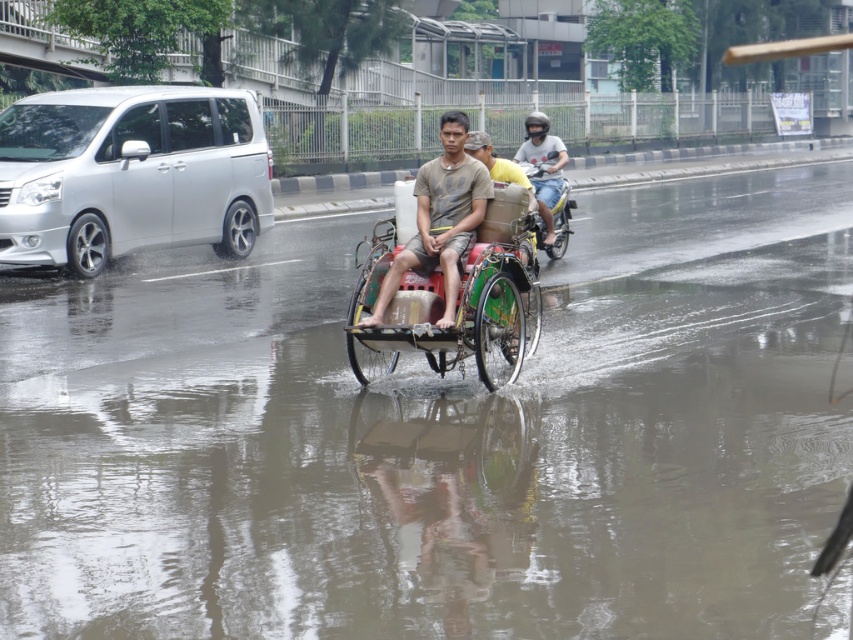
You are a delivery driver who needs to park your vehicle near the silver metallic van at left without blocking the rickshaw. Based on the coordinates provided in the scene description, where should you position your vehicle?

The silver metallic van at left is located at point (131, 173). To park near it without blocking the rickshaw, position your vehicle close to those coordinates but ensure it doesn not obstruct the rickshaw.

You are a pedestrian trying to cross the street and see the brown fabric tricycle at center and the matte black helmet at upper center. Which object is nearer to you?

The brown fabric tricycle at center is closer to the viewer than the matte black helmet at upper center, so the tricycle is nearer.

In the scene shown: You are a delivery person who needs to park your vehicle next to the silver metallic van at left and the brown fabric tricycle at center. Since the parking space is narrow, which vehicle should you park closer to the curb to avoid blocking the road?

The silver metallic van at left is wider than the brown fabric tricycle at center, so you should park the wider van closer to the curb to minimize obstruction of the road.